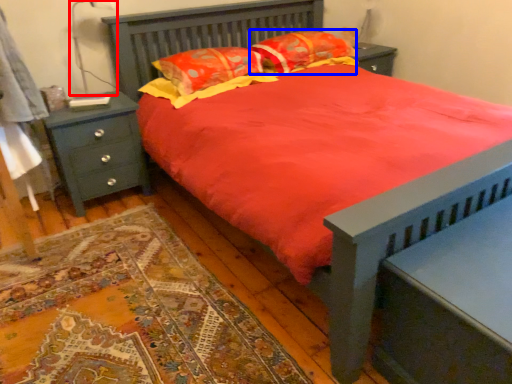
Question: Which object appears closest to the camera in this image, table lamp (highlighted by a red box) or pillow (highlighted by a blue box)?

Choices:
 (A) table lamp
 (B) pillow

Answer: (A)